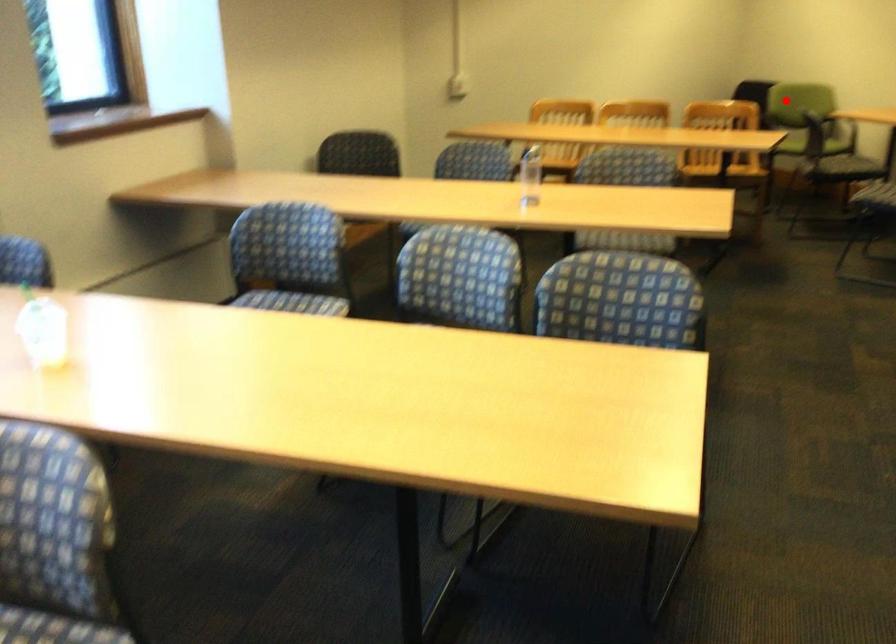
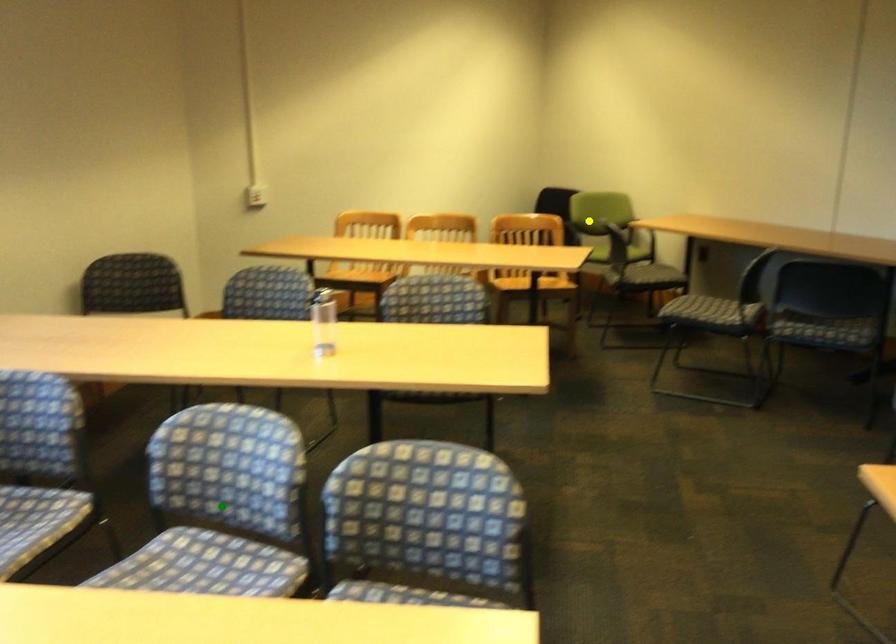
Question: I am providing you with two images of the same scene from different viewpoints. A red point is marked on the first image. You are given multiple points on the second image. Can you choose the point in image 2 that corresponds to the point in image 1?

Choices:
 (A) blue point
 (B) yellow point
 (C) green point

Answer: (B)